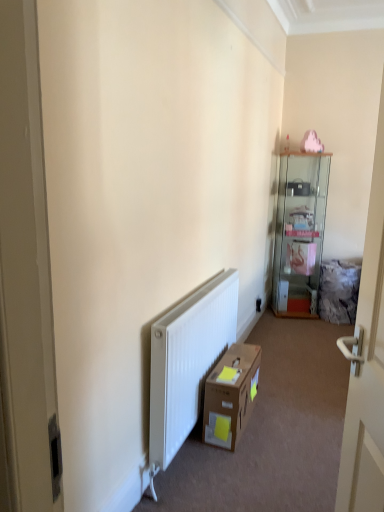
Question: Should I look upward or downward to see white glossy door at right?

Choices:
 (A) down
 (B) up

Answer: (A)

Question: Does black plastic electric outlet at center appear on the left side of white glossy door at right?

Choices:
 (A) yes
 (B) no

Answer: (B)

Question: Is the depth of black plastic electric outlet at center greater than that of white glossy door at right?

Choices:
 (A) yes
 (B) no

Answer: (A)

Question: Can you confirm if black plastic electric outlet at center is positioned to the right of white glossy door at right?

Choices:
 (A) no
 (B) yes

Answer: (B)

Question: Would you say white glossy door at right is part of black plastic electric outlet at center's contents?

Choices:
 (A) yes
 (B) no

Answer: (B)

Question: From a real-world perspective, is black plastic electric outlet at center under white glossy door at right?

Choices:
 (A) no
 (B) yes

Answer: (B)

Question: From the image's perspective, does black plastic electric outlet at center appear lower than white glossy door at right?

Choices:
 (A) yes
 (B) no

Answer: (A)

Question: Is clear glass cabinet at upper right taller than brown cardboard box at lower center?

Choices:
 (A) yes
 (B) no

Answer: (A)

Question: Can you confirm if clear glass cabinet at upper right is shorter than brown cardboard box at lower center?

Choices:
 (A) no
 (B) yes

Answer: (A)

Question: From the image's perspective, is clear glass cabinet at upper right beneath brown cardboard box at lower center?

Choices:
 (A) no
 (B) yes

Answer: (A)

Question: Is clear glass cabinet at upper right turned away from brown cardboard box at lower center?

Choices:
 (A) no
 (B) yes

Answer: (A)

Question: Is clear glass cabinet at upper right thinner than brown cardboard box at lower center?

Choices:
 (A) no
 (B) yes

Answer: (A)

Question: Does clear glass cabinet at upper right come behind brown cardboard box at lower center?

Choices:
 (A) yes
 (B) no

Answer: (A)

Question: Would you say black plastic electric outlet at center is a long distance from brown cardboard box at lower center?

Choices:
 (A) yes
 (B) no

Answer: (A)